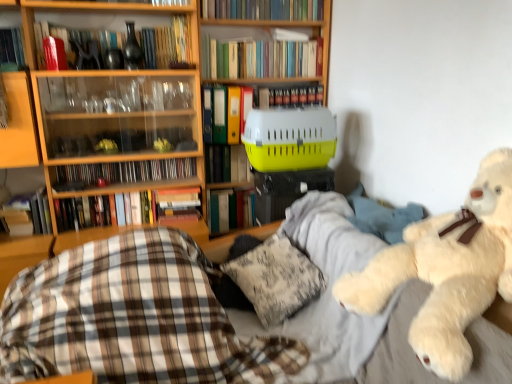
Locate an element on the screen. Image resolution: width=512 pixels, height=384 pixels. fluffy white pillow at center is located at coordinates (268, 278).

What is the approximate height of hardcover book at upper center, the 1th book in the top-to-bottom sequence?

It is 5.12 inches.

At what (x,y) coordinates should I click in order to perform the action: click on hardcover books at upper center, positioned as the third book in top-to-bottom order. Please return your answer as a coordinate pair (x, y). Looking at the image, I should click on (292, 96).

This screenshot has height=384, width=512. What are the coordinates of `plaid fabric at lower left` in the screenshot? It's located at (131, 318).

Locate an element on the screen. The height and width of the screenshot is (384, 512). yellow plastic pet carrier at center is located at coordinates (270, 58).

Image resolution: width=512 pixels, height=384 pixels. What do you see at coordinates (128, 209) in the screenshot?
I see `hardcover book at center, the 7th book when ordered from top to bottom` at bounding box center [128, 209].

Where is `fluffy white pillow at center`? This screenshot has width=512, height=384. fluffy white pillow at center is located at coordinates (268, 278).

Find the location of `cabinet that appears in front of the matte black cd case at upper left, the 4th book when ordered from bottom to top`. cabinet that appears in front of the matte black cd case at upper left, the 4th book when ordered from bottom to top is located at coordinates (270, 58).

Is yellow plastic pet carrier at center a part of matte black cd case at upper left, the 4th book when ordered from bottom to top?

Definitely not — yellow plastic pet carrier at center is not inside matte black cd case at upper left, the 4th book when ordered from bottom to top.

Who is more distant, matte black cd case at upper left, arranged as the sixth book when viewed from the top, or yellow plastic pet carrier at center?

matte black cd case at upper left, arranged as the sixth book when viewed from the top.

How distant is matte black cd case at upper left, the 4th book when ordered from bottom to top, from yellow plastic pet carrier at center?

69.22 centimeters.

How many degrees apart are the facing directions of yellow plastic pet carrier at center and yellow plastic crate at center, the fifth book from the bottom?

yellow plastic pet carrier at center and yellow plastic crate at center, the fifth book from the bottom, are facing 0.000486 degrees away from each other.

Is yellow plastic pet carrier at center in front of or behind yellow plastic crate at center, which is the fifth book from top to bottom, in the image?

In the image, yellow plastic pet carrier at center appears in front of yellow plastic crate at center, which is the fifth book from top to bottom.

Consider the image. From a real-world perspective, between yellow plastic pet carrier at center and yellow plastic crate at center, which is the fifth book from top to bottom, who is vertically lower?

yellow plastic crate at center, which is the fifth book from top to bottom, is physically lower.

Considering the points (302, 135) and (210, 177), which point is behind, point (302, 135) or point (210, 177)?

Positioned behind is point (210, 177).

From the image's perspective, who appears lower, fluffy white pillow at center or hardcover books at upper center, which ranks as the eighth book in bottom-to-top order?

fluffy white pillow at center.

Could you tell me if fluffy white pillow at center is facing hardcover books at upper center, which is the 2th book from top to bottom?

No.

Does fluffy white pillow at center have a smaller size compared to hardcover books at upper center, which ranks as the eighth book in bottom-to-top order?

No.

From a real-world perspective, which object rests below the other?

In real-world perspective, fluffy white pillow at center is lower.

Can you tell me how much yellow plastic crate at center, the fifth book from the bottom, and fluffy white teddy bear at right differ in facing direction?

yellow plastic crate at center, the fifth book from the bottom, and fluffy white teddy bear at right are facing 93.2 degrees away from each other.

Can you confirm if yellow plastic crate at center, the fifth book from the bottom, is positioned to the right of fluffy white teddy bear at right?

Incorrect, yellow plastic crate at center, the fifth book from the bottom, is not on the right side of fluffy white teddy bear at right.

Is yellow plastic crate at center, the fifth book from the bottom, not close to fluffy white teddy bear at right?

yellow plastic crate at center, the fifth book from the bottom, is positioned a significant distance from fluffy white teddy bear at right.

Does yellow plastic crate at center, which is the fifth book from top to bottom, contain fluffy white teddy bear at right?

No, fluffy white teddy bear at right is not inside yellow plastic crate at center, which is the fifth book from top to bottom.

Consider the image. Between yellow plastic pet carrier at center and hardcover book at left, the first book ordered from the bottom, which one has larger size?

With larger size is yellow plastic pet carrier at center.

Consider the image. Is the depth of yellow plastic pet carrier at center less than that of hardcover book at left, which is the ninth book from top to bottom?

No, the depth of yellow plastic pet carrier at center is greater than that of hardcover book at left, which is the ninth book from top to bottom.

From the image's perspective, which one is positioned higher, yellow plastic pet carrier at center or hardcover book at left, which is the ninth book from top to bottom?

yellow plastic pet carrier at center, from the image's perspective.

Is yellow plastic pet carrier at center wider or thinner than hardcover book at left, which is the ninth book from top to bottom?

Clearly, yellow plastic pet carrier at center has more width compared to hardcover book at left, which is the ninth book from top to bottom.

Where is `the 4th book to the right when counting from the plaid fabric at lower left`? The height and width of the screenshot is (384, 512). the 4th book to the right when counting from the plaid fabric at lower left is located at coordinates (261, 58).

Looking at this image, which is closer, (71, 288) or (220, 44)?

Clearly, point (71, 288) is closer to the camera than point (220, 44).

Measure the distance between plaid fabric at lower left and hardcover books at upper center, which ranks as the eighth book in bottom-to-top order.

A distance of 1.42 meters exists between plaid fabric at lower left and hardcover books at upper center, which ranks as the eighth book in bottom-to-top order.

Would you say green matte folder at center, marked as the 6th book in a bottom-to-top arrangement, is to the left or to the right of hardcover book at center, the 7th book when ordered from top to bottom, in the picture?

green matte folder at center, marked as the 6th book in a bottom-to-top arrangement, is to the right of hardcover book at center, the 7th book when ordered from top to bottom.

From the image's perspective, does green matte folder at center, marked as the 6th book in a bottom-to-top arrangement, appear higher than hardcover book at center, marked as the third book in a bottom-to-top arrangement?

Yes, from the image's perspective, green matte folder at center, marked as the 6th book in a bottom-to-top arrangement, is above hardcover book at center, marked as the third book in a bottom-to-top arrangement.

Considering the relative sizes of green matte folder at center, arranged as the fourth book when viewed from the top, and hardcover book at center, marked as the third book in a bottom-to-top arrangement, in the image provided, is green matte folder at center, arranged as the fourth book when viewed from the top, shorter than hardcover book at center, marked as the third book in a bottom-to-top arrangement,?

Incorrect, the height of green matte folder at center, arranged as the fourth book when viewed from the top, does not fall short of that of hardcover book at center, marked as the third book in a bottom-to-top arrangement.

From a real-world perspective, which object rests below the other?

From a 3D spatial view, hardcover book at center, the 7th book when ordered from top to bottom, is below.

Where is `cabinet that appears above the matte black cd case at upper left, the 4th book when ordered from bottom to top (from the image's perspective)`? Image resolution: width=512 pixels, height=384 pixels. cabinet that appears above the matte black cd case at upper left, the 4th book when ordered from bottom to top (from the image's perspective) is located at coordinates (270, 58).

At what (x,y) coordinates should I click in order to perform the action: click on the 5th book to the left when counting from the yellow plastic pet carrier at center. Please return your answer as a coordinate pair (x, y). Looking at the image, I should click on (226, 164).

When comparing their distances from hardcover book at upper center, acting as the ninth book starting from the bottom, does plaid fabric at lower left or yellow plastic pet carrier at center seem closer?

yellow plastic pet carrier at center.

Which object lies nearer to the anchor point green matte folder at center, arranged as the fourth book when viewed from the top, yellow plastic crate at center, which is the fifth book from top to bottom, or hardcover book at center, the 7th book when ordered from top to bottom?

yellow plastic crate at center, which is the fifth book from top to bottom, is closer to green matte folder at center, arranged as the fourth book when viewed from the top.

Estimate the real-world distances between objects in this image. Which object is further from matte black cd case at upper left, arranged as the sixth book when viewed from the top, fluffy white pillow at center or hardcover book at center, positioned as the eighth book in top-to-bottom order?

fluffy white pillow at center is further to matte black cd case at upper left, arranged as the sixth book when viewed from the top.

Looking at the image, which one is located closer to fluffy white teddy bear at right, yellow plastic pet carrier at center or green matte folder at center, arranged as the fourth book when viewed from the top?

yellow plastic pet carrier at center lies closer to fluffy white teddy bear at right than the other object.

Estimate the real-world distances between objects in this image. Which object is closer to green matte folder at center, marked as the 6th book in a bottom-to-top arrangement, hardcover book at center, marked as the third book in a bottom-to-top arrangement, or yellow plastic pet carrier at center?

yellow plastic pet carrier at center.

Looking at this image, which object lies nearer to the anchor point yellow plastic crate at center, the fifth book from the bottom, plaid fabric at lower left or hardcover books at upper center, positioned as the third book in top-to-bottom order?

Based on the image, hardcover books at upper center, positioned as the third book in top-to-bottom order, appears to be nearer to yellow plastic crate at center, the fifth book from the bottom.

Based on their spatial positions, is green matte folder at center, marked as the 6th book in a bottom-to-top arrangement, or hardcover book at left, the first book ordered from the bottom, closer to hardcover books at upper center, positioned as the third book in top-to-bottom order?

The object closer to hardcover books at upper center, positioned as the third book in top-to-bottom order, is green matte folder at center, marked as the 6th book in a bottom-to-top arrangement.

Based on their spatial positions, is wooden bookcase at upper left or hardcover book at center, the 7th book when ordered from top to bottom, closer to hardcover book at center, positioned as the eighth book in top-to-bottom order?

hardcover book at center, the 7th book when ordered from top to bottom, is positioned closer to the anchor hardcover book at center, positioned as the eighth book in top-to-bottom order.

Identify the location of plaid located between wooden bookcase at upper left and yellow plastic pet carrier at center in the left-right direction. (131, 318).

Find the location of a particular element. The width and height of the screenshot is (512, 384). cabinet between hardcover books at upper center, which is the 2th book from top to bottom, and yellow plastic pet carrier at center in the up-down direction is located at coordinates (270, 58).

Image resolution: width=512 pixels, height=384 pixels. In order to click on bookcase that lies between hardcover book at upper center, acting as the ninth book starting from the bottom, and matte black cd case at upper left, arranged as the sixth book when viewed from the top, from top to bottom in this screenshot , I will do click(115, 132).

Locate an element on the screen. cabinet located between hardcover book at center, marked as the third book in a bottom-to-top arrangement, and hardcover books at upper center, positioned as the third book in top-to-bottom order, in the left-right direction is located at coordinates (270, 58).